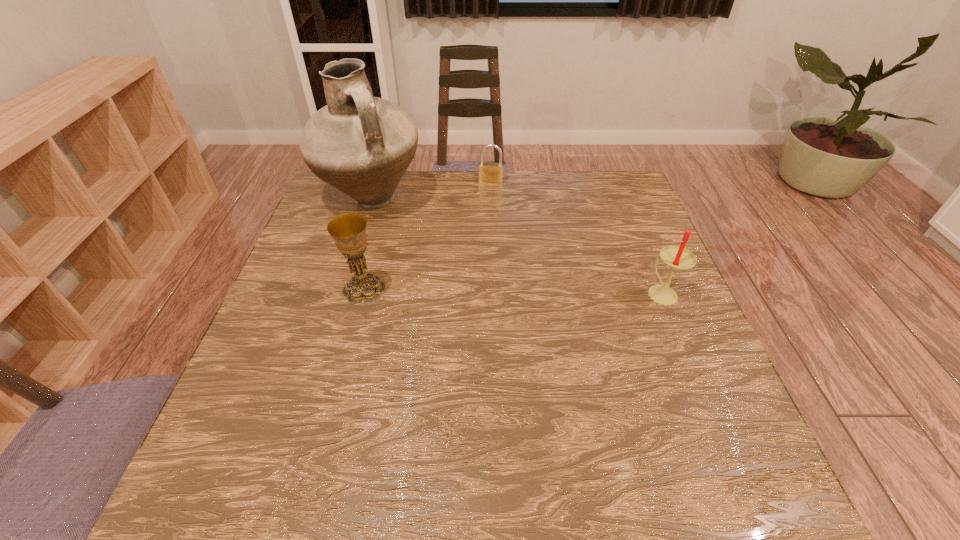
The image size is (960, 540). What are the coordinates of `vacant space on the desktop that is between the chalice and the candle and is positioned on the front-facing side of the second object from right to left` in the screenshot? It's located at (481, 291).

Identify the location of free spot on the desktop that is between the chalice and the rightmost object and is positioned on the handle side of the pitcher. The width and height of the screenshot is (960, 540). (509, 291).